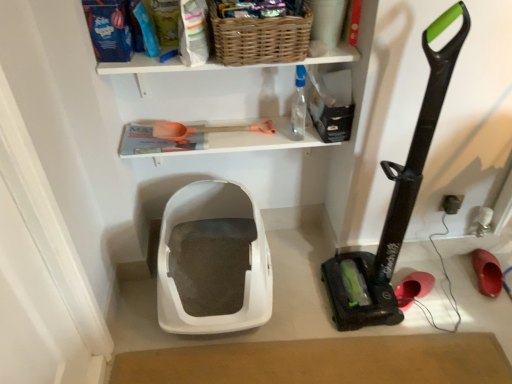
Locate an element on the screen. Image resolution: width=512 pixels, height=384 pixels. vacant area that lies between black plastic vacuum cleaner at right and rubber matte shoe at lower right, the second footwear positioned from the left is located at coordinates pos(442,282).